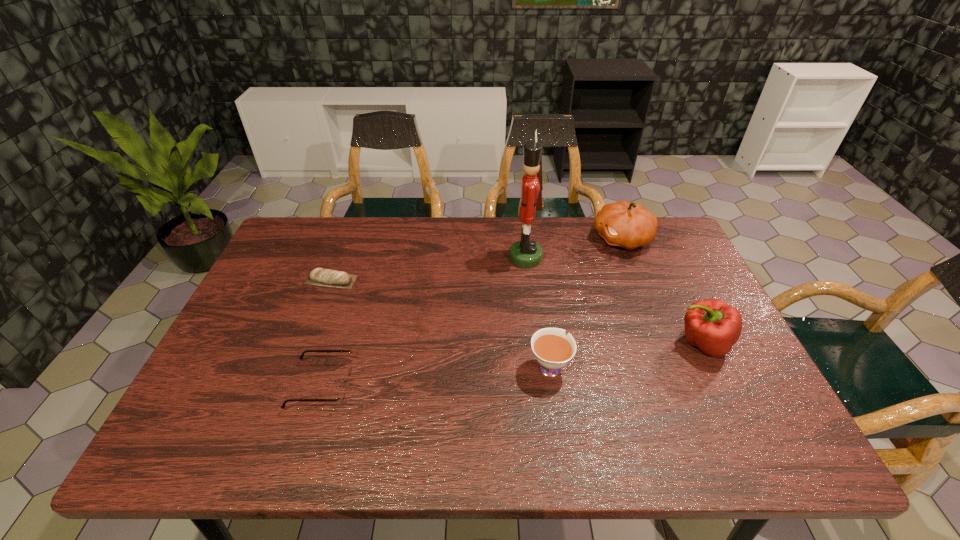
You are a GUI agent. You are given a task and a screenshot of the screen. Output one action in this format:
    pyautogui.click(x=<x>, y=<y>)
    Task: Click on the pumpkin that is at the far edge
    
    Given the screenshot: What is the action you would take?
    pyautogui.click(x=624, y=224)

This screenshot has height=540, width=960. Identify the location of object positioned at the left edge. (322, 277).

Identify the location of pumpkin situated at the right edge. This screenshot has height=540, width=960. (624, 224).

The height and width of the screenshot is (540, 960). I want to click on bell pepper that is at the right edge, so click(x=713, y=326).

At what (x,y) coordinates should I click in order to perform the action: click on object situated at the far right corner. Please return your answer as a coordinate pair (x, y). The height and width of the screenshot is (540, 960). Looking at the image, I should click on (624, 224).

In the image, there is a desktop. Identify the location of vacant space at the far edge. (511, 246).

In the image, there is a desktop. At what (x,y) coordinates should I click in order to perform the action: click on free space at the near edge. Please return your answer as a coordinate pair (x, y). This screenshot has width=960, height=540. Looking at the image, I should click on (342, 440).

This screenshot has width=960, height=540. In order to click on vacant region at the left edge of the desktop in this screenshot , I will do `click(215, 382)`.

The width and height of the screenshot is (960, 540). Find the location of `free spot at the right edge of the desktop`. free spot at the right edge of the desktop is located at coordinates (679, 357).

Locate an element on the screen. vacant area that lies between the teacup and the tallest object is located at coordinates (538, 312).